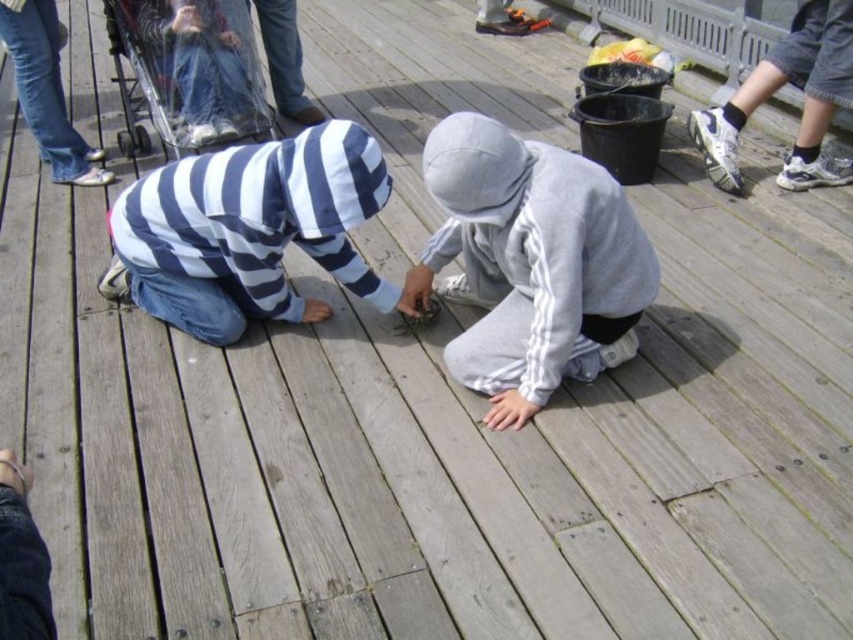
Who is higher up, gray fleece hoodie at center or striped hoodie at center?

Positioned higher is striped hoodie at center.

Based on the photo, can you confirm if gray fleece hoodie at center is bigger than striped hoodie at center?

Yes.

Is point (560, 218) closer to viewer compared to point (380, 166)?

Yes, point (560, 218) is closer to viewer.

Locate an element on the screen. gray fleece hoodie at center is located at coordinates (529, 253).